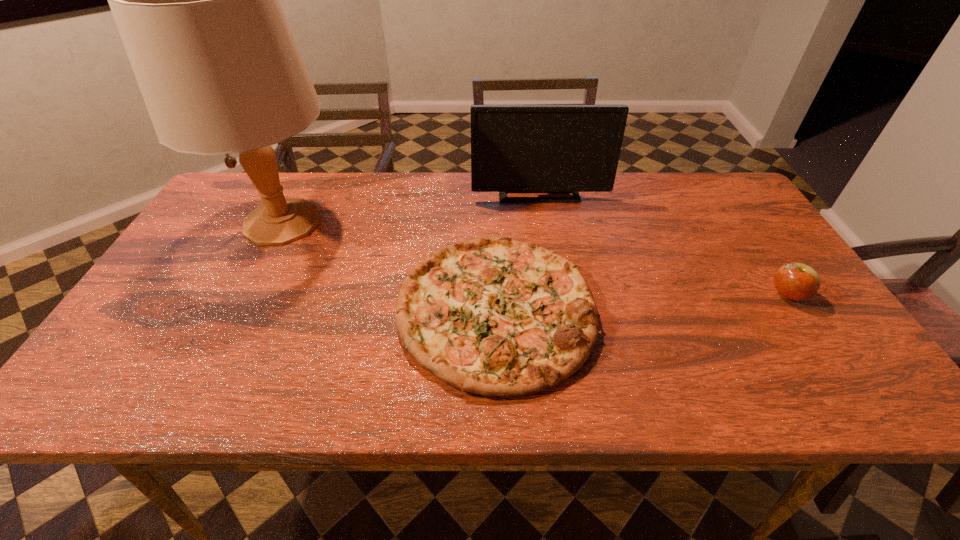
You are a GUI agent. You are given a task and a screenshot of the screen. Output one action in this format:
    pyautogui.click(x=<x>, y=<y>)
    Task: Click on the vacant space that satisfies the following two spatial constraints: 1. on the back side of the rightmost object; 2. on the left side of the shortest object
    
    Given the screenshot: What is the action you would take?
    pyautogui.click(x=495, y=294)

The width and height of the screenshot is (960, 540). Identify the location of free space in the image that satisfies the following two spatial constraints: 1. on the front side of the pizza; 2. on the right side of the table lamp. (238, 309).

I want to click on free point that satisfies the following two spatial constraints: 1. on the screen side of the third shortest object; 2. on the left side of the apple, so click(x=556, y=294).